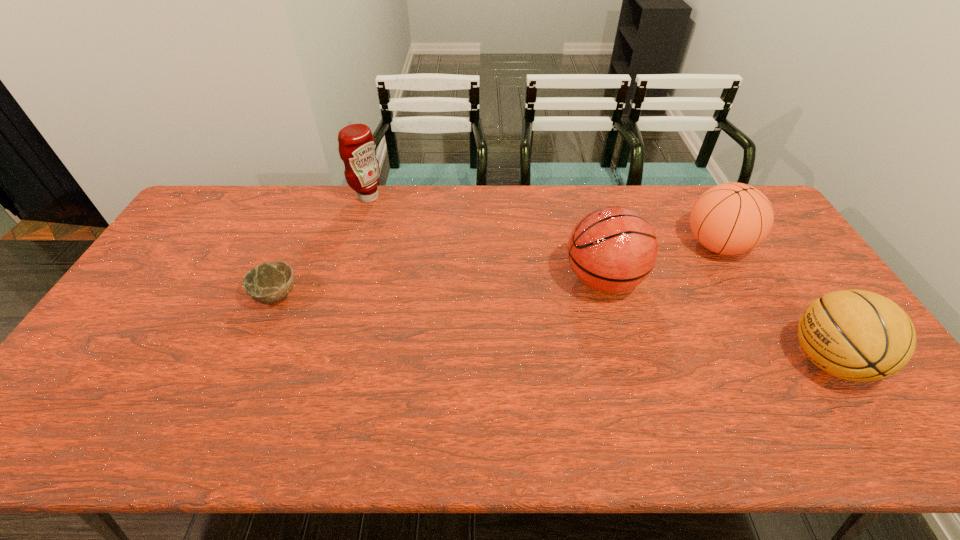
The width and height of the screenshot is (960, 540). In the image, there is a desktop. In order to click on blank space at the right edge in this screenshot , I will do `click(786, 245)`.

The image size is (960, 540). Find the location of `vacant area at the far left corner`. vacant area at the far left corner is located at coordinates (219, 216).

Identify the location of vacant area that lies between the third object from right to left and the nearest object. Image resolution: width=960 pixels, height=540 pixels. (716, 320).

This screenshot has height=540, width=960. What are the coordinates of `free space between the bowl and the condiment` in the screenshot? It's located at (323, 246).

This screenshot has height=540, width=960. What are the coordinates of `free space between the nearest object and the third object from right to left` in the screenshot? It's located at (716, 320).

Locate an element on the screen. free space that is in between the leftmost basketball and the nearest basketball is located at coordinates (716, 320).

At what (x,y) coordinates should I click in order to perform the action: click on free space that is in between the second object from left to right and the bowl. Please return your answer as a coordinate pair (x, y). Looking at the image, I should click on (323, 246).

Locate an element on the screen. free area in between the shortest object and the nearest basketball is located at coordinates (552, 328).

You are a GUI agent. You are given a task and a screenshot of the screen. Output one action in this format:
    pyautogui.click(x=<x>, y=<y>)
    Task: Click on the vacant space in between the bowl and the nearest object
    
    Given the screenshot: What is the action you would take?
    pyautogui.click(x=552, y=328)

Locate an element on the screen. This screenshot has height=540, width=960. the fourth closest object to the leftmost basketball is located at coordinates (267, 283).